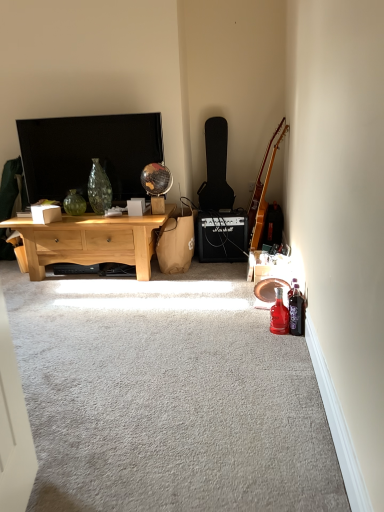
At what (x,y) coordinates should I click in order to perform the action: click on vacant area situated below white cardboard box at center, the 2th box viewed from the right (from a real-world perspective). Please return your answer as a coordinate pair (x, y). Looking at the image, I should click on (58, 218).